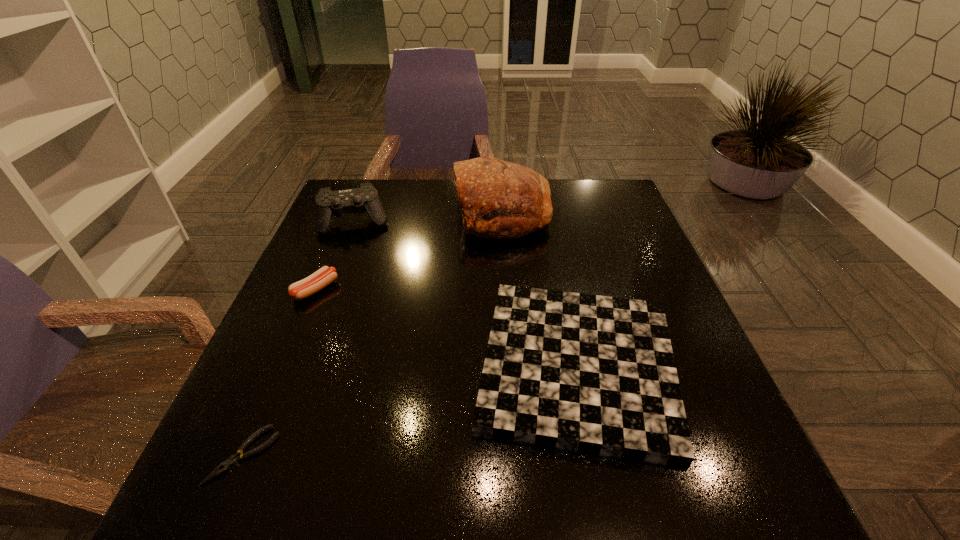
Where is `free space that is in between the checkerboard and the pliers`? The height and width of the screenshot is (540, 960). free space that is in between the checkerboard and the pliers is located at coordinates (410, 411).

Where is `vacant region between the sausage and the tallest object`? Image resolution: width=960 pixels, height=540 pixels. vacant region between the sausage and the tallest object is located at coordinates (409, 252).

The width and height of the screenshot is (960, 540). In order to click on free point between the sausage and the fourth shortest object in this screenshot , I will do `click(336, 255)`.

This screenshot has width=960, height=540. In order to click on free space that is in between the sausage and the shortest object in this screenshot , I will do `click(279, 373)`.

The width and height of the screenshot is (960, 540). In order to click on free space between the tallest object and the pliers in this screenshot , I will do `click(373, 334)`.

Where is `free spot between the control and the checkerboard`? The width and height of the screenshot is (960, 540). free spot between the control and the checkerboard is located at coordinates (467, 294).

In order to click on free spot between the checkerboard and the sausage in this screenshot , I will do `click(446, 328)`.

The image size is (960, 540). In order to click on vacant region between the shortest object and the bread in this screenshot , I will do `click(373, 334)`.

Locate an element on the screen. Image resolution: width=960 pixels, height=540 pixels. object that is the nearest to the checkerboard is located at coordinates (498, 199).

Identify which object is the second nearest to the second tallest object. Please provide its 2D coordinates. Your answer should be formatted as a tuple, i.e. [(x, y)], where the tuple contains the x and y coordinates of a point satisfying the conditions above.

[(498, 199)]